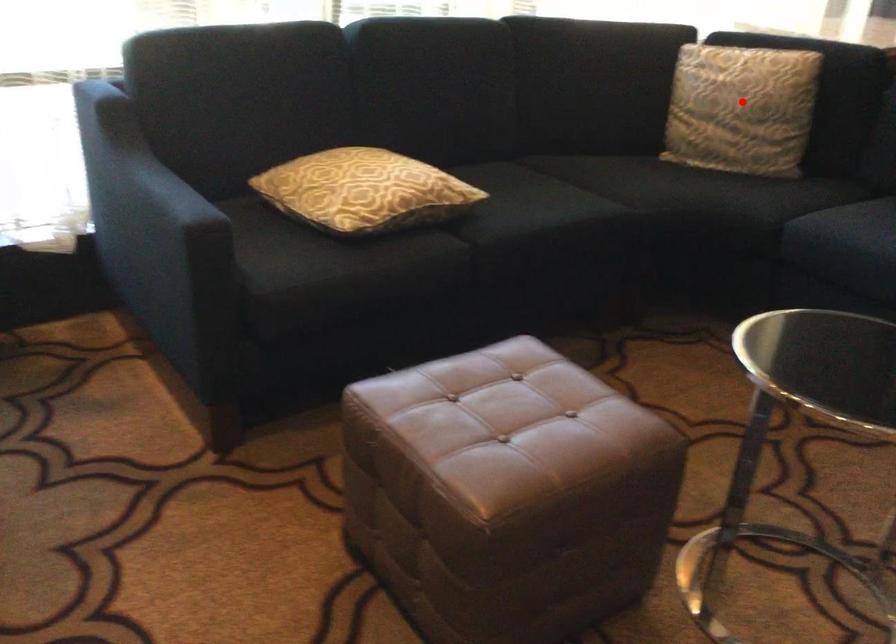
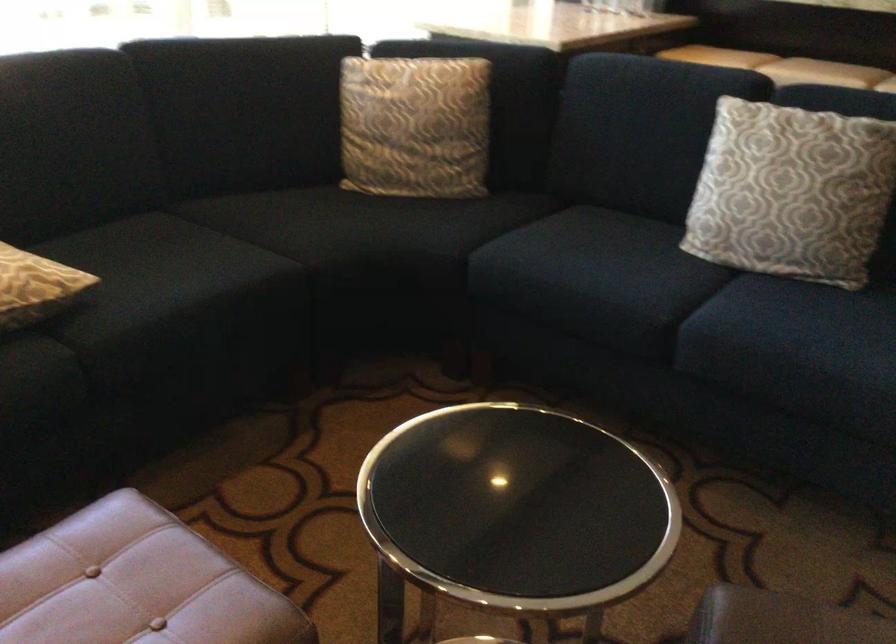
Find the pixel in the second image that matches the highlighted location in the first image.

(415, 126)